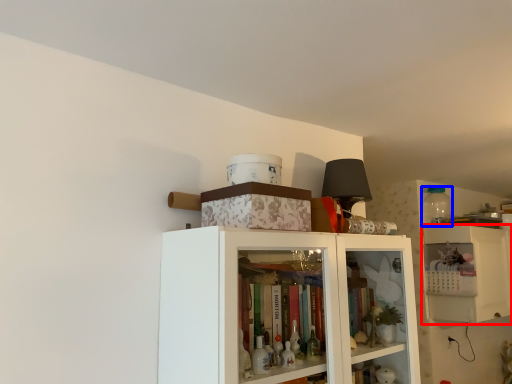
Question: Which point is further to the camera, cabinetry (highlighted by a red box) or bottle (highlighted by a blue box)?

Choices:
 (A) cabinetry
 (B) bottle

Answer: (B)